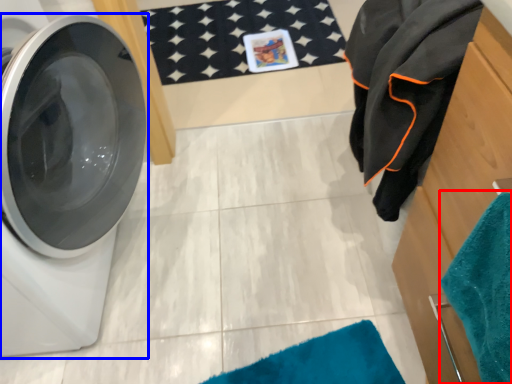
Question: Among these objects, which one is farthest to the camera, beach towel (highlighted by a red box) or washing machine (highlighted by a blue box)?

Choices:
 (A) beach towel
 (B) washing machine

Answer: (B)